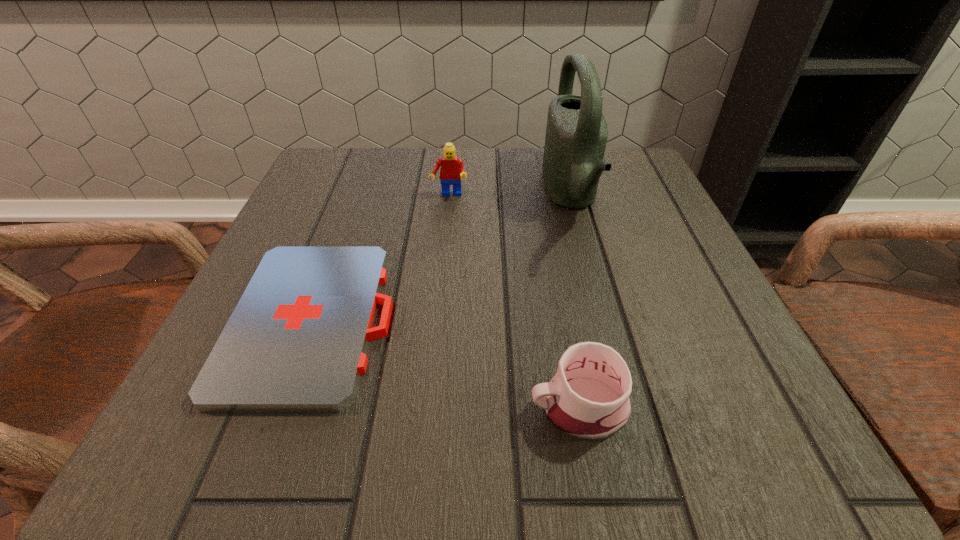
Identify the location of object identified as the closest to the mug. (296, 341).

The image size is (960, 540). Identify the location of blank space that satisfies the following two spatial constraints: 1. on the front-facing side of the Lego; 2. on handle side the leftmost object. (438, 320).

Identify the location of free location that satisfies the following two spatial constraints: 1. on the front-facing side of the Lego; 2. on handle side the first-aid kit. This screenshot has width=960, height=540. (438, 320).

The height and width of the screenshot is (540, 960). What are the coordinates of `vacant space that satisfies the following two spatial constraints: 1. on the spout of the watering can; 2. on the front-facing side of the second object from left to right` in the screenshot? It's located at (570, 195).

Identify the location of free spot that satisfies the following two spatial constraints: 1. on the front-facing side of the second tallest object; 2. on handle side the first-aid kit. The height and width of the screenshot is (540, 960). (438, 320).

Identify the location of vacant space that satisfies the following two spatial constraints: 1. on the front-facing side of the Lego; 2. on handle side the leftmost object. (438, 320).

The width and height of the screenshot is (960, 540). Identify the location of vacant space that satisfies the following two spatial constraints: 1. on the spout of the watering can; 2. on the front-facing side of the second object from left to right. 570,195.